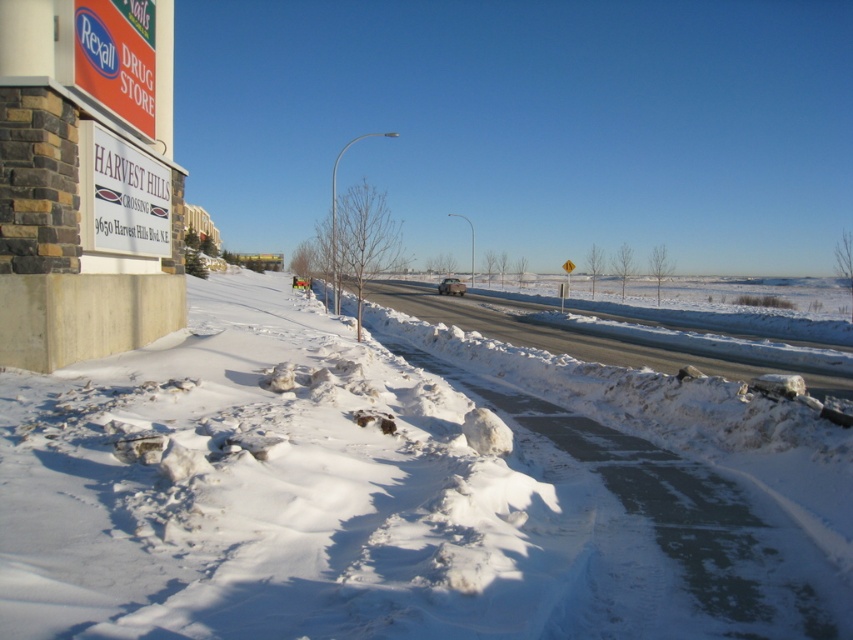
Question: Estimate the real-world distances between objects in this image. Which object is closer to the white plastic sign at upper left?

Choices:
 (A) matte red sign at upper left
 (B) white powdery snow at lower left
 (C) metallic silver car at center
 (D) white asphalt highway at center

Answer: (A)

Question: Where is white asphalt highway at center located in relation to matte red sign at upper left in the image?

Choices:
 (A) right
 (B) left

Answer: (A)

Question: Can you confirm if white powdery snow at lower left is bigger than metallic silver car at center?

Choices:
 (A) yes
 (B) no

Answer: (A)

Question: Can you confirm if white asphalt highway at center is positioned to the left of metallic silver car at center?

Choices:
 (A) no
 (B) yes

Answer: (B)

Question: Which of these objects is positioned farthest from the white powdery snow at lower left?

Choices:
 (A) metallic silver car at center
 (B) matte red sign at upper left
 (C) white plastic sign at upper left
 (D) white asphalt highway at center

Answer: (A)

Question: Which point appears closest to the camera in this image?

Choices:
 (A) (88, 84)
 (B) (448, 291)

Answer: (A)